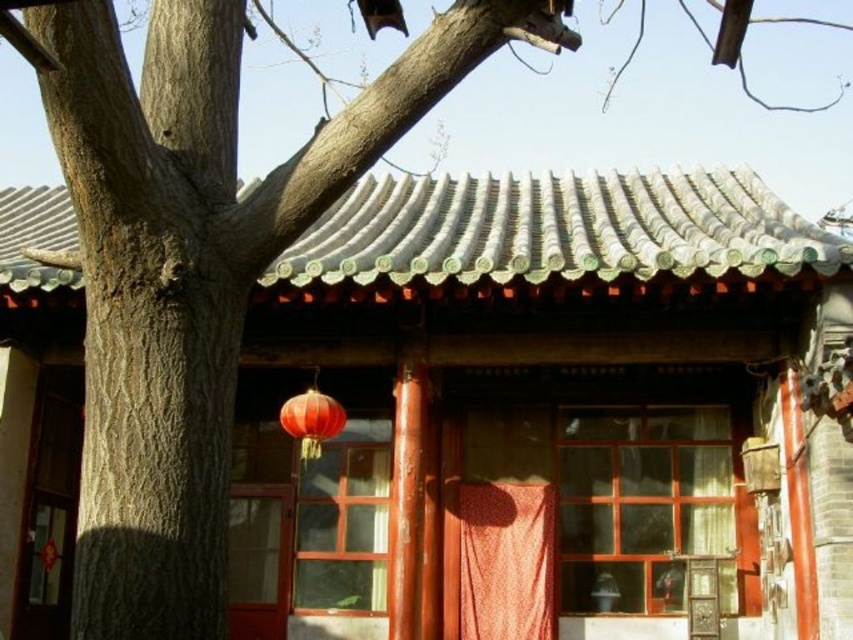
Question: Does wooden door at lower left have a larger size compared to wooden door at center?

Choices:
 (A) yes
 (B) no

Answer: (A)

Question: Which point appears closest to the camera in this image?

Choices:
 (A) (283, 563)
 (B) (334, 433)
 (C) (57, 476)
 (D) (526, 605)

Answer: (B)

Question: Is orange fabric curtain at center behind matte red lantern at center?

Choices:
 (A) no
 (B) yes

Answer: (B)

Question: Which point is farther to the camera?

Choices:
 (A) orange fabric curtain at center
 (B) wooden door at lower left

Answer: (A)

Question: Estimate the real-world distances between objects in this image. Which object is farther from the wooden door at lower left?

Choices:
 (A) orange fabric curtain at center
 (B) matte red lantern at center
 (C) wooden door at center

Answer: (A)

Question: Is wooden door at center closer to the viewer compared to matte red lantern at center?

Choices:
 (A) no
 (B) yes

Answer: (A)